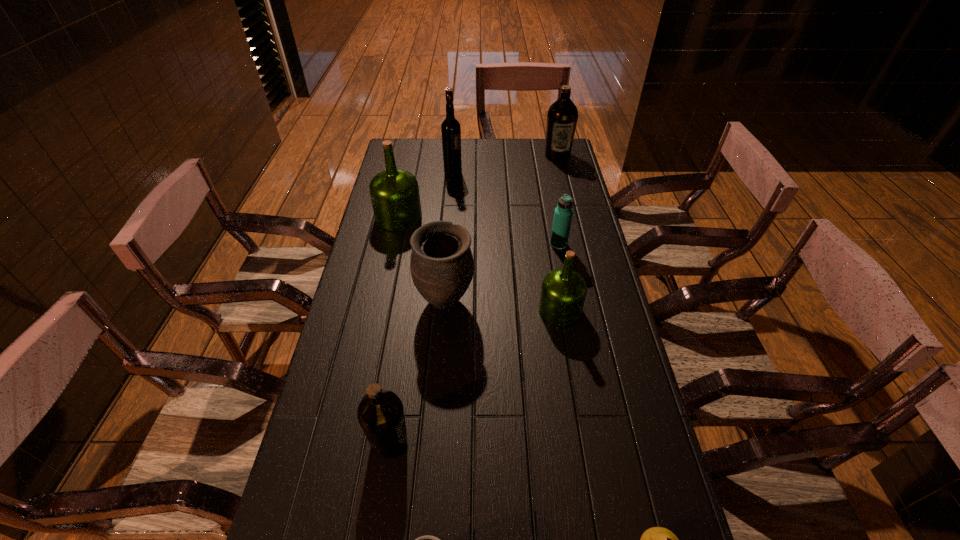
Locate an element on the screen. wine bottle is located at coordinates coord(450,128).

What are the coordinates of `the farthest object` in the screenshot? It's located at (562, 116).

This screenshot has height=540, width=960. I want to click on the right brown olive oil, so click(x=562, y=116).

This screenshot has height=540, width=960. Identify the location of the third farthest object. (395, 197).

Where is `the left green olive oil`? This screenshot has width=960, height=540. the left green olive oil is located at coordinates (395, 197).

This screenshot has height=540, width=960. In order to click on urn in this screenshot , I will do `click(441, 264)`.

The height and width of the screenshot is (540, 960). In order to click on the right green olive oil in this screenshot , I will do `click(563, 291)`.

Image resolution: width=960 pixels, height=540 pixels. Find the location of `the nearer green olive oil`. the nearer green olive oil is located at coordinates (563, 291).

Where is `the nearest olive oil`? The image size is (960, 540). the nearest olive oil is located at coordinates (380, 413).

The height and width of the screenshot is (540, 960). What are the coordinates of `the nearer brown olive oil` in the screenshot? It's located at (380, 413).